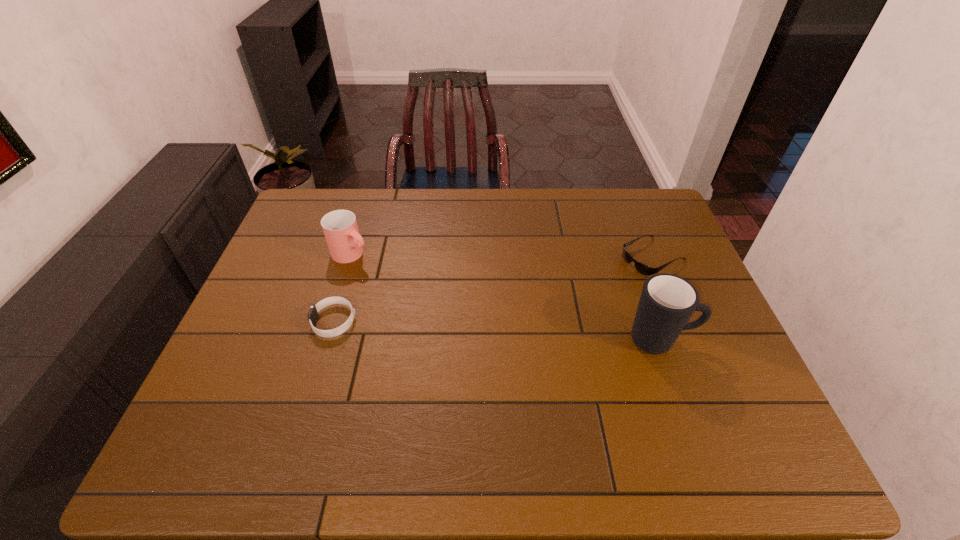
Find the location of `free space on the desktop that is between the wristband and the tallest object and is positioned on the side of the second tallest object with the handle`. free space on the desktop that is between the wristband and the tallest object and is positioned on the side of the second tallest object with the handle is located at coordinates (475, 329).

Find the location of a particular element. Image resolution: width=960 pixels, height=540 pixels. free spot on the desktop that is between the wristband and the mug and is positioned on the front-facing side of the sunglasses is located at coordinates (509, 331).